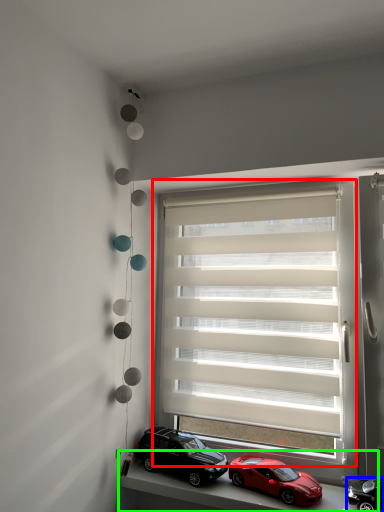
Question: Which object is the farthest from window blind (highlighted by a red box)? Choose among these: car (highlighted by a blue box) or window sill (highlighted by a green box).

Choices:
 (A) car
 (B) window sill

Answer: (A)